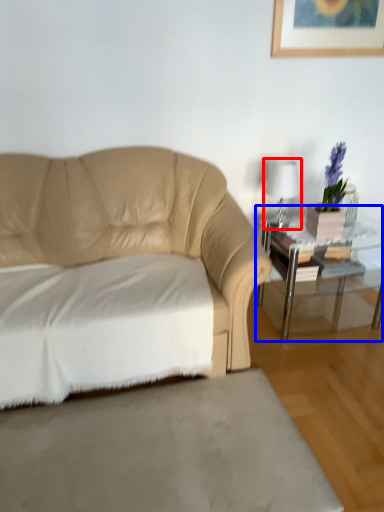
Question: Among these objects, which one is nearest to the camera, table lamp (highlighted by a red box) or table (highlighted by a blue box)?

Choices:
 (A) table lamp
 (B) table

Answer: (B)